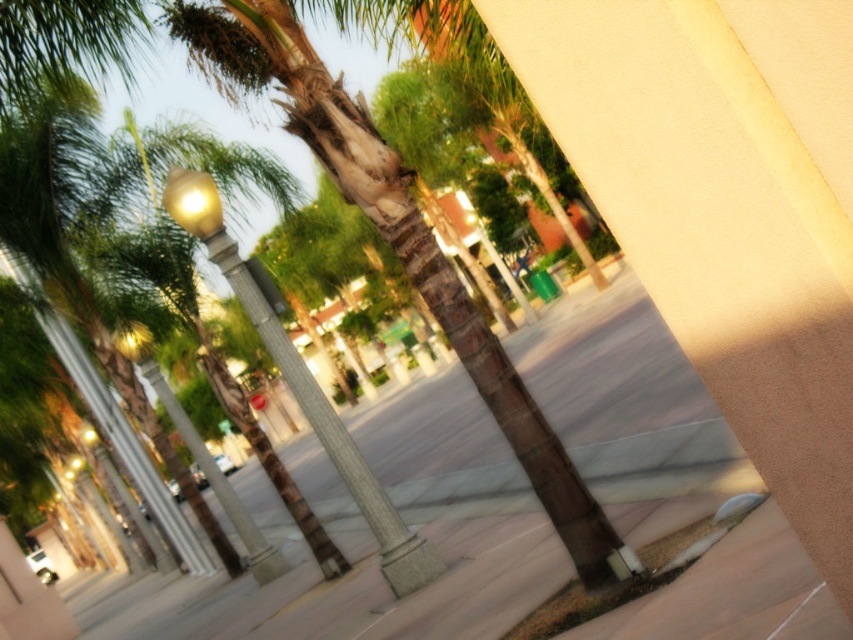
Is point (653, 467) closer to camera compared to point (294, 93)?

No, it is not.

Is the position of smooth concrete pavement at center less distant than that of green textured palm tree at center?

That is False.

Between point (171, 621) and point (405, 198), which one is positioned behind?

The point (171, 621) is behind.

Locate an element on the screen. Image resolution: width=853 pixels, height=640 pixels. smooth concrete pavement at center is located at coordinates (625, 401).

Between green textured palm tree at center and matte gold lamp post at left, which one is positioned higher?

matte gold lamp post at left

Between green textured palm tree at center and matte gold lamp post at left, which one is positioned lower?

green textured palm tree at center is lower down.

Is point (494, 349) in front of point (433, 563)?

Yes, it is.

You are a GUI agent. You are given a task and a screenshot of the screen. Output one action in this format:
    pyautogui.click(x=<x>, y=<y>)
    Task: Click on the green textured palm tree at center
    
    Given the screenshot: What is the action you would take?
    pyautogui.click(x=397, y=241)

From the picture: Can you confirm if smooth concrete pavement at center is shorter than matte gold lamp post at left?

No, smooth concrete pavement at center is not shorter than matte gold lamp post at left.

Which is behind, point (477, 481) or point (258, 296)?

Positioned behind is point (477, 481).

This screenshot has width=853, height=640. What do you see at coordinates (625, 401) in the screenshot?
I see `smooth concrete pavement at center` at bounding box center [625, 401].

Locate an element on the screen. This screenshot has width=853, height=640. smooth concrete pavement at center is located at coordinates (625, 401).